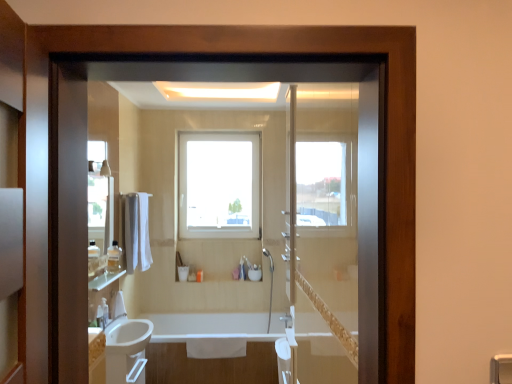
Question: From the image's perspective, does clear plastic bottle at lower left, which is the 2th toiletry in bottom-to-top order, appear higher than clear glass mirror at upper left?

Choices:
 (A) yes
 (B) no

Answer: (B)

Question: Is clear plastic bottle at lower left, which is counted as the first toiletry, starting from the left, further to camera compared to clear glass mirror at upper left?

Choices:
 (A) yes
 (B) no

Answer: (A)

Question: Considering the relative sizes of clear plastic bottle at lower left, which is the 2th toiletry in bottom-to-top order, and clear glass mirror at upper left in the image provided, is clear plastic bottle at lower left, which is the 2th toiletry in bottom-to-top order, bigger than clear glass mirror at upper left?

Choices:
 (A) no
 (B) yes

Answer: (A)

Question: From the image's perspective, would you say clear plastic bottle at lower left, positioned as the second toiletry in top-to-bottom order, is shown under clear glass mirror at upper left?

Choices:
 (A) yes
 (B) no

Answer: (A)

Question: From a real-world perspective, is clear plastic bottle at lower left, positioned as the second toiletry in top-to-bottom order, physically above clear glass mirror at upper left?

Choices:
 (A) no
 (B) yes

Answer: (A)

Question: In terms of height, does clear plastic bottle at lower left, which is counted as the first toiletry, starting from the left, look taller or shorter compared to clear glass shelf at left?

Choices:
 (A) tall
 (B) short

Answer: (A)

Question: Considering the positions of clear plastic bottle at lower left, positioned as the second toiletry in top-to-bottom order, and clear glass shelf at left in the image, is clear plastic bottle at lower left, positioned as the second toiletry in top-to-bottom order, bigger or smaller than clear glass shelf at left?

Choices:
 (A) big
 (B) small

Answer: (B)

Question: Considering the positions of clear plastic bottle at lower left, which is the 2th toiletry in bottom-to-top order, and clear glass shelf at left in the image, is clear plastic bottle at lower left, which is the 2th toiletry in bottom-to-top order, wider or thinner than clear glass shelf at left?

Choices:
 (A) thin
 (B) wide

Answer: (A)

Question: From a real-world perspective, is clear plastic bottle at lower left, positioned as the second toiletry in top-to-bottom order, physically located above or below clear glass shelf at left?

Choices:
 (A) above
 (B) below

Answer: (B)

Question: Is clear glass shelf at left bigger or smaller than clear plastic bottle at lower left, which is the 2th toiletry in bottom-to-top order?

Choices:
 (A) big
 (B) small

Answer: (A)

Question: Considering the positions of clear glass shelf at left and clear plastic bottle at lower left, positioned as the second toiletry in top-to-bottom order, in the image, is clear glass shelf at left taller or shorter than clear plastic bottle at lower left, positioned as the second toiletry in top-to-bottom order,?

Choices:
 (A) short
 (B) tall

Answer: (A)

Question: Considering the positions of clear glass shelf at left and clear plastic bottle at lower left, which is counted as the first toiletry, starting from the left, in the image, is clear glass shelf at left wider or thinner than clear plastic bottle at lower left, which is counted as the first toiletry, starting from the left,?

Choices:
 (A) thin
 (B) wide

Answer: (B)

Question: Is clear glass shelf at left inside the boundaries of clear plastic bottle at lower left, the 3th toiletry from the back, or outside?

Choices:
 (A) inside
 (B) outside

Answer: (B)

Question: Is white glossy bathtub at lower center wider or thinner than clear glass mirror at upper left?

Choices:
 (A) thin
 (B) wide

Answer: (B)

Question: In the image, is white glossy bathtub at lower center on the left side or the right side of clear glass mirror at upper left?

Choices:
 (A) left
 (B) right

Answer: (B)